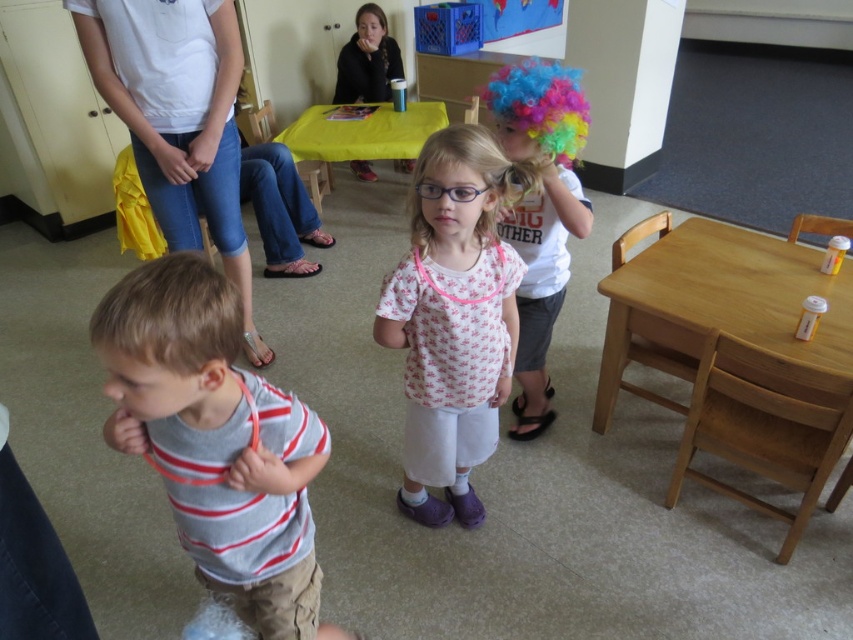
Question: Which object is positioned closest to the multicolored wig at upper center?

Choices:
 (A) pink fabric shirt at center
 (B) light brown wooden table at right
 (C) gray striped shirt at center
 (D) yellow plastic table at upper center

Answer: (A)

Question: Which object is the closest to the gray striped shirt at center?

Choices:
 (A) light brown wooden table at right
 (B) yellow plastic table at upper center

Answer: (A)

Question: Does pink fabric shirt at center have a greater width compared to multicolored wig at upper center?

Choices:
 (A) yes
 (B) no

Answer: (A)

Question: Does gray striped shirt at center appear over pink fabric shirt at center?

Choices:
 (A) no
 (B) yes

Answer: (A)

Question: Among these points, which one is farthest from the camera?

Choices:
 (A) (579, 205)
 (B) (683, 305)
 (C) (273, 544)
 (D) (430, 243)

Answer: (B)

Question: Is gray striped shirt at center in front of light brown wooden table at right?

Choices:
 (A) yes
 (B) no

Answer: (A)